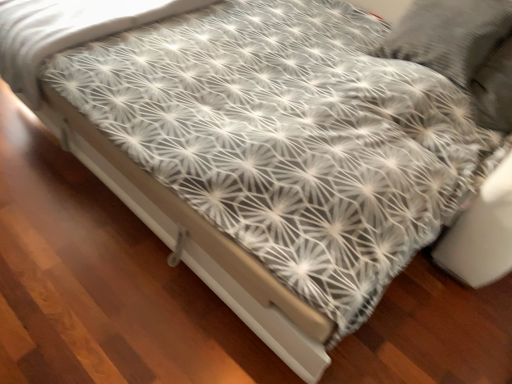
Question: Considering the positions of white matte bed frame at center and white textured fabric at center in the image, is white matte bed frame at center bigger or smaller than white textured fabric at center?

Choices:
 (A) big
 (B) small

Answer: (B)

Question: From a real-world perspective, is white matte bed frame at center above or below white textured fabric at center?

Choices:
 (A) below
 (B) above

Answer: (A)

Question: In the image, is white matte bed frame at center on the left side or the right side of white textured fabric at center?

Choices:
 (A) right
 (B) left

Answer: (A)

Question: Is white textured fabric at center to the left or to the right of white matte bed frame at center in the image?

Choices:
 (A) left
 (B) right

Answer: (A)

Question: Which is correct: white textured fabric at center is inside white matte bed frame at center, or outside of it?

Choices:
 (A) inside
 (B) outside

Answer: (B)

Question: Is white textured fabric at center taller or shorter than white matte bed frame at center?

Choices:
 (A) tall
 (B) short

Answer: (A)

Question: From a real-world perspective, is white textured fabric at center above or below white matte bed frame at center?

Choices:
 (A) below
 (B) above

Answer: (B)